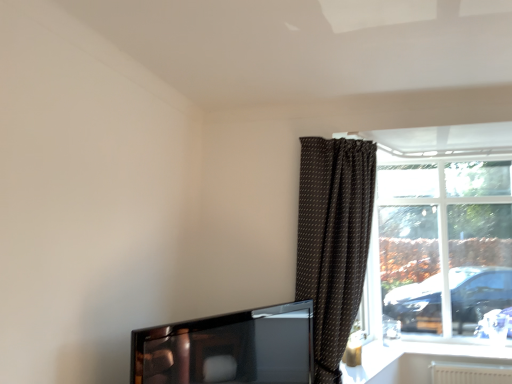
At what (x,y) coordinates should I click in order to perform the action: click on white glossy window sill at lower right. Please return your answer as a coordinate pair (x, y). The width and height of the screenshot is (512, 384). Looking at the image, I should click on (450, 346).

The width and height of the screenshot is (512, 384). I want to click on transparent glass window at right, so click(x=440, y=234).

Where is `curtain that is in front of the white glossy window sill at lower right`? curtain that is in front of the white glossy window sill at lower right is located at coordinates (333, 241).

Is brown dotted fabric curtain at right inside or outside of white glossy window sill at lower right?

brown dotted fabric curtain at right is not enclosed by white glossy window sill at lower right.

Is brown dotted fabric curtain at right not near white glossy window sill at lower right?

Yes, brown dotted fabric curtain at right and white glossy window sill at lower right are quite far apart.

Which of these two, transparent glass window at right or shiny black tv at lower left, is wider?

With larger width is shiny black tv at lower left.

Identify the location of television that is in front of the transparent glass window at right. (229, 348).

Between transparent glass window at right and shiny black tv at lower left, which one appears on the right side from the viewer's perspective?

transparent glass window at right is more to the right.

Looking at this image, in the image, is transparent glass window at right positioned in front of or behind shiny black tv at lower left?

transparent glass window at right is positioned farther from the viewer than shiny black tv at lower left.

Looking at the image, does white glossy window sill at lower right seem bigger or smaller compared to brown dotted fabric curtain at right?

Considering their sizes, white glossy window sill at lower right takes up less space than brown dotted fabric curtain at right.

Considering the positions of point (449, 342) and point (330, 343), is point (449, 342) closer or farther from the camera than point (330, 343)?

Point (449, 342) is farther from the camera than point (330, 343).

Consider the image. From the image's perspective, which is above, white glossy window sill at lower right or brown dotted fabric curtain at right?

brown dotted fabric curtain at right is shown above in the image.

Considering the relative positions of white glossy window sill at lower right and brown dotted fabric curtain at right in the image provided, is white glossy window sill at lower right behind brown dotted fabric curtain at right?

Yes, white glossy window sill at lower right is further from the viewer.

Is point (224, 379) farther from viewer compared to point (311, 224)?

That is False.

Are shiny black tv at lower left and brown dotted fabric curtain at right beside each other?

No, shiny black tv at lower left is not making contact with brown dotted fabric curtain at right.

From a real-world perspective, which object stands above the other?

brown dotted fabric curtain at right is physically above.

From the image's perspective, between white glossy window sill at lower right and transparent glass window at right, which one is located above?

transparent glass window at right appears higher in the image.

Is white glossy window sill at lower right looking in the opposite direction of transparent glass window at right?

That's right, white glossy window sill at lower right is facing away from transparent glass window at right.

Is white glossy window sill at lower right beside transparent glass window at right?

No, white glossy window sill at lower right is not making contact with transparent glass window at right.

From a real-world perspective, which object stands above the other?

In real-world perspective, transparent glass window at right is above.

Is brown dotted fabric curtain at right looking in the opposite direction of transparent glass window at right?

No.

From the image's perspective, would you say brown dotted fabric curtain at right is positioned over transparent glass window at right?

Yes, from the image's perspective, brown dotted fabric curtain at right is over transparent glass window at right.

Can you confirm if brown dotted fabric curtain at right is smaller than transparent glass window at right?

No.

Does brown dotted fabric curtain at right come in front of transparent glass window at right?

Yes, it is.

Considering the relative sizes of brown dotted fabric curtain at right and shiny black tv at lower left in the image provided, is brown dotted fabric curtain at right taller than shiny black tv at lower left?

Indeed, brown dotted fabric curtain at right has a greater height compared to shiny black tv at lower left.

Is brown dotted fabric curtain at right turned away from shiny black tv at lower left?

No, brown dotted fabric curtain at right is not facing away from shiny black tv at lower left.

Are brown dotted fabric curtain at right and shiny black tv at lower left located far from each other?

No, brown dotted fabric curtain at right is in close proximity to shiny black tv at lower left.

From a real-world perspective, is brown dotted fabric curtain at right positioned over shiny black tv at lower left based on gravity?

Yes, from a real-world perspective, brown dotted fabric curtain at right is over shiny black tv at lower left

Locate an element on the screen. Image resolution: width=512 pixels, height=384 pixels. curtain that is above the white glossy window sill at lower right (from a real-world perspective) is located at coordinates pyautogui.click(x=333, y=241).

Identify the location of television below the transparent glass window at right (from the image's perspective). This screenshot has height=384, width=512. (229, 348).

Which object lies nearer to the anchor point shiny black tv at lower left, brown dotted fabric curtain at right or white glossy window sill at lower right?

brown dotted fabric curtain at right is closer to shiny black tv at lower left.

When comparing their distances from white glossy window sill at lower right, does shiny black tv at lower left or brown dotted fabric curtain at right seem further?

Based on the image, shiny black tv at lower left appears to be further to white glossy window sill at lower right.

From the image, which object appears to be nearer to shiny black tv at lower left, transparent glass window at right or white glossy window sill at lower right?

white glossy window sill at lower right is closer to shiny black tv at lower left.

From the image, which object appears to be farther from transparent glass window at right, brown dotted fabric curtain at right or shiny black tv at lower left?

Among the two, shiny black tv at lower left is located further to transparent glass window at right.

When comparing their distances from shiny black tv at lower left, does white glossy window sill at lower right or brown dotted fabric curtain at right seem further?

white glossy window sill at lower right is positioned further to the anchor shiny black tv at lower left.

From the image, which object appears to be nearer to brown dotted fabric curtain at right, transparent glass window at right or white glossy window sill at lower right?

Among the two, transparent glass window at right is located nearer to brown dotted fabric curtain at right.

Considering their positions, is shiny black tv at lower left positioned closer to brown dotted fabric curtain at right than transparent glass window at right?

Among the two, shiny black tv at lower left is located nearer to brown dotted fabric curtain at right.

Looking at the image, which one is located closer to shiny black tv at lower left, white glossy window sill at lower right or transparent glass window at right?

white glossy window sill at lower right lies closer to shiny black tv at lower left than the other object.

Find the location of a particular element. window sill located between brown dotted fabric curtain at right and transparent glass window at right in the left-right direction is located at coordinates (450, 346).

The height and width of the screenshot is (384, 512). Find the location of `curtain located between shiny black tv at lower left and white glossy window sill at lower right in the left-right direction`. curtain located between shiny black tv at lower left and white glossy window sill at lower right in the left-right direction is located at coordinates 333,241.

Find the location of a particular element. The image size is (512, 384). window sill between shiny black tv at lower left and transparent glass window at right along the z-axis is located at coordinates (450, 346).

Identify the location of curtain between shiny black tv at lower left and transparent glass window at right along the z-axis. The width and height of the screenshot is (512, 384). click(333, 241).